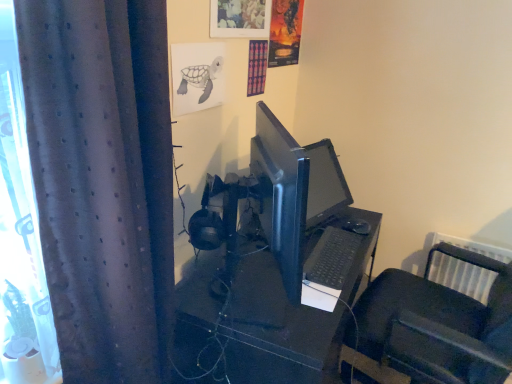
At what (x,y) coordinates should I click in order to perform the action: click on vacant region above black plastic chair at lower right (from a real-world perspective). Please return your answer as a coordinate pair (x, y). Looking at the image, I should click on (477, 236).